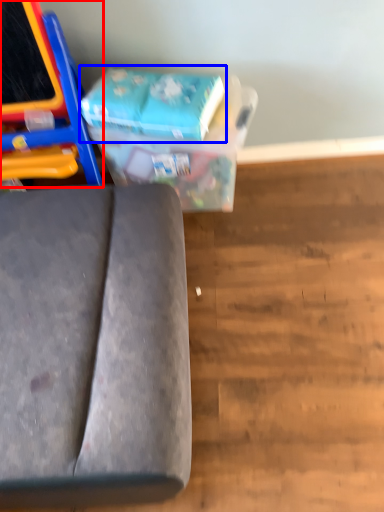
Question: Which point is closer to the camera, furniture (highlighted by a red box) or paperback book (highlighted by a blue box)?

Choices:
 (A) furniture
 (B) paperback book

Answer: (A)